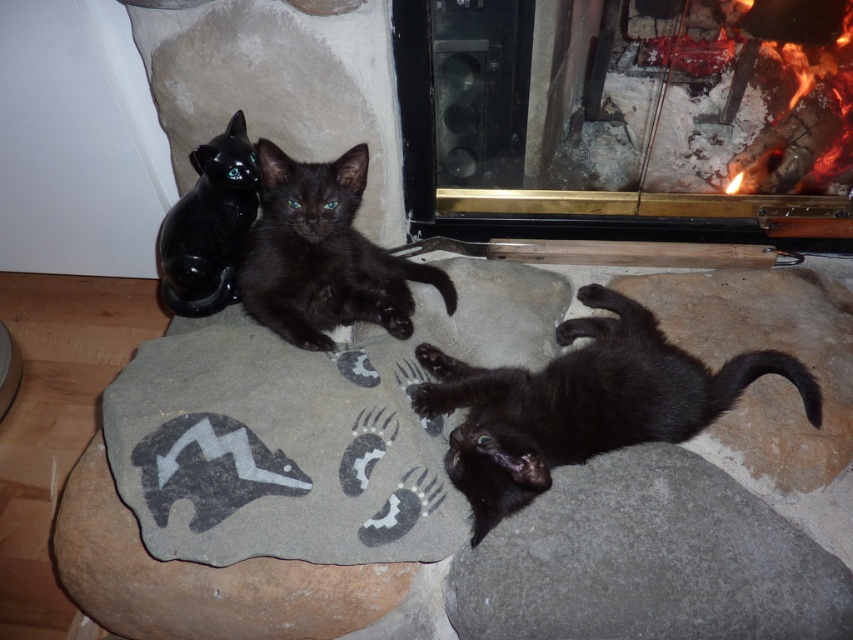
Question: Does charcoal ash fireplace at upper right have a greater width compared to black fur cat at lower right?

Choices:
 (A) no
 (B) yes

Answer: (B)

Question: Does charcoal ash fireplace at upper right appear under matte black kitten at center?

Choices:
 (A) yes
 (B) no

Answer: (B)

Question: Which of the following is the farthest from the observer?

Choices:
 (A) black fur cat at lower right
 (B) matte black kitten at center

Answer: (B)

Question: Can you confirm if charcoal ash fireplace at upper right is thinner than matte black kitten at center?

Choices:
 (A) no
 (B) yes

Answer: (A)

Question: Estimate the real-world distances between objects in this image. Which object is closer to the charcoal ash fireplace at upper right?

Choices:
 (A) matte black kitten at center
 (B) black fur cat at lower right

Answer: (A)

Question: Which point is farther from the camera taking this photo?

Choices:
 (A) click(x=485, y=451)
 (B) click(x=432, y=269)

Answer: (B)